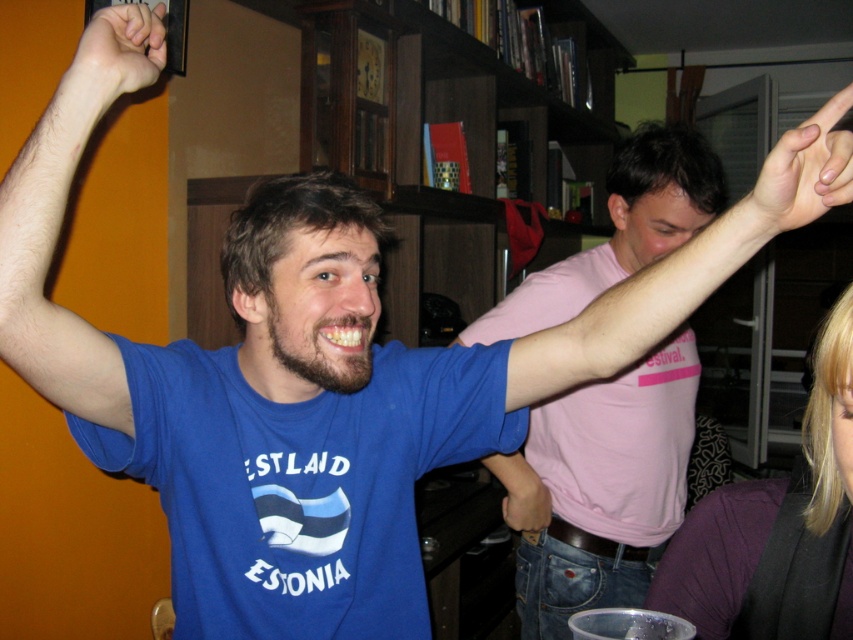
Question: Is pink cotton t-shirt at upper center bigger than smooth skin hand at upper right?

Choices:
 (A) no
 (B) yes

Answer: (B)

Question: Which of the following is the farthest from the observer?

Choices:
 (A) smooth skin hand at upper right
 (B) dark purple fabric at lower right

Answer: (A)

Question: Considering the relative positions of pink cotton t-shirt at upper center and smooth skin hand at upper right in the image provided, where is pink cotton t-shirt at upper center located with respect to smooth skin hand at upper right?

Choices:
 (A) above
 (B) below

Answer: (B)

Question: Is dark purple fabric at lower right wider than hairless skin at upper left?

Choices:
 (A) yes
 (B) no

Answer: (A)

Question: Which point is closer to the camera?

Choices:
 (A) (537, 483)
 (B) (850, 205)
 (C) (141, 16)
 (D) (850, 401)

Answer: (D)

Question: Which object is positioned closest to the matte blue shirt at upper center?

Choices:
 (A) pink cotton t-shirt at upper center
 (B) dark purple fabric at lower right
 (C) hairless skin at upper left

Answer: (A)